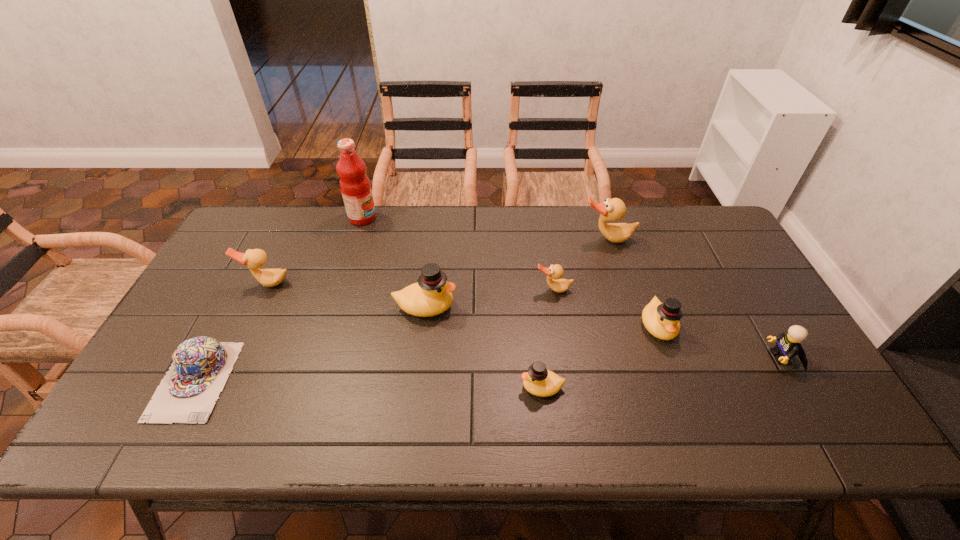
This screenshot has width=960, height=540. Find the location of `the smallest tan duck`. the smallest tan duck is located at coordinates (554, 272).

This screenshot has width=960, height=540. Identify the location of the nearest yellow duck. (539, 381).

At what (x,y) coordinates should I click in order to perform the action: click on the second yellow duck from right to left. Please return your answer as a coordinate pair (x, y). The image size is (960, 540). Looking at the image, I should click on (539, 381).

This screenshot has height=540, width=960. I want to click on cap, so click(x=200, y=366).

Locate an element on the screen. This screenshot has height=540, width=960. blank space located on the front label of the fruit juice is located at coordinates (454, 218).

Locate an element on the screen. This screenshot has height=540, width=960. vacant space situated on the beak of the farthest duck is located at coordinates (627, 300).

Locate an element on the screen. free region located 0.160m on the front-facing side of the leftmost yellow duck is located at coordinates (514, 307).

Identify the location of free space located 0.310m on the beak of the leftmost tan duck. (220, 383).

You are a GUI agent. You are given a task and a screenshot of the screen. Output one action in this format:
    pyautogui.click(x=<x>, y=<y>)
    Task: Click on the blank space located on the front-facing side of the second smallest yellow duck
    The height and width of the screenshot is (540, 960).
    Given the screenshot: What is the action you would take?
    pyautogui.click(x=674, y=370)

In order to click on vacant region located on the front-facing side of the Lego in this screenshot , I will do `click(666, 357)`.